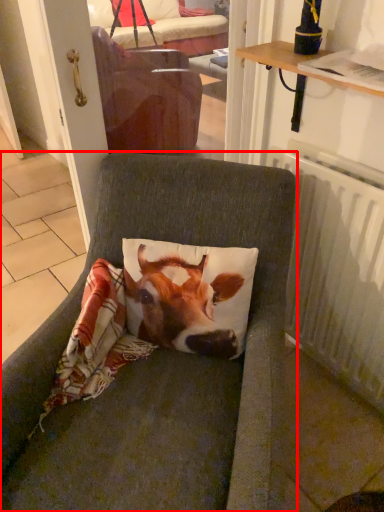
Question: From the image's perspective, what is the correct spatial positioning of chair (annotated by the red box) in reference to radiator?

Choices:
 (A) below
 (B) above

Answer: (A)